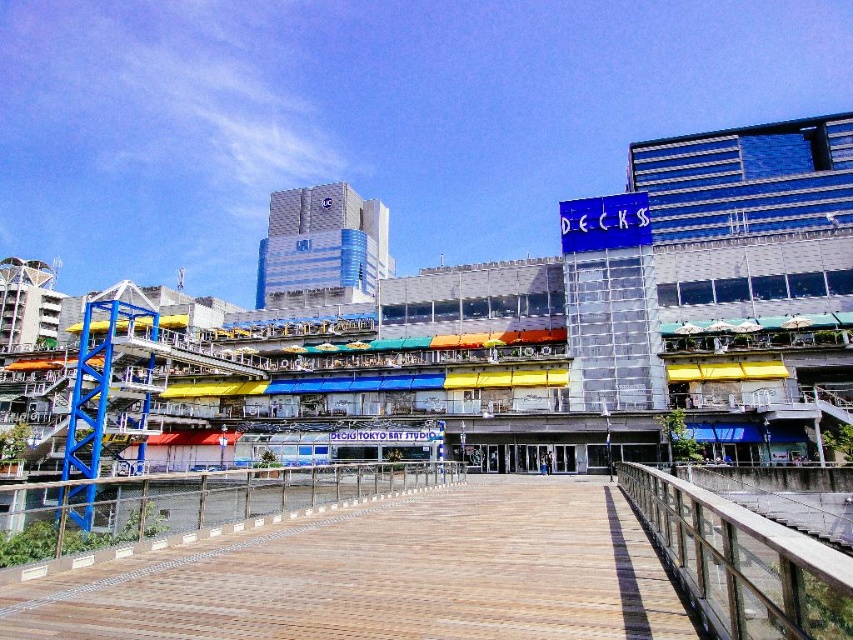
Which is below, wooden deck at center or metallic silver railing at center?

Positioned lower is metallic silver railing at center.

Which is more to the left, wooden deck at center or metallic silver railing at center?

metallic silver railing at center

Which is in front, point (320, 612) or point (384, 472)?

Point (320, 612) is in front.

Where is `wooden deck at center`? The width and height of the screenshot is (853, 640). wooden deck at center is located at coordinates (383, 576).

Measure the distance between wooden at center and camera.

wooden at center is 12.53 meters away from camera.

Locate an element on the screen. This screenshot has height=640, width=853. wooden at center is located at coordinates (741, 563).

Locate an element on the screen. The height and width of the screenshot is (640, 853). wooden at center is located at coordinates (741, 563).

Between blue glass building at center and wooden deck at center, which one appears on the right side from the viewer's perspective?

blue glass building at center is more to the right.

Does blue glass building at center have a lesser width compared to wooden deck at center?

Incorrect, blue glass building at center's width is not less than wooden deck at center's.

Between point (363, 234) and point (311, 605), which one is positioned behind?

Positioned behind is point (363, 234).

Image resolution: width=853 pixels, height=640 pixels. I want to click on blue glass building at center, so click(512, 332).